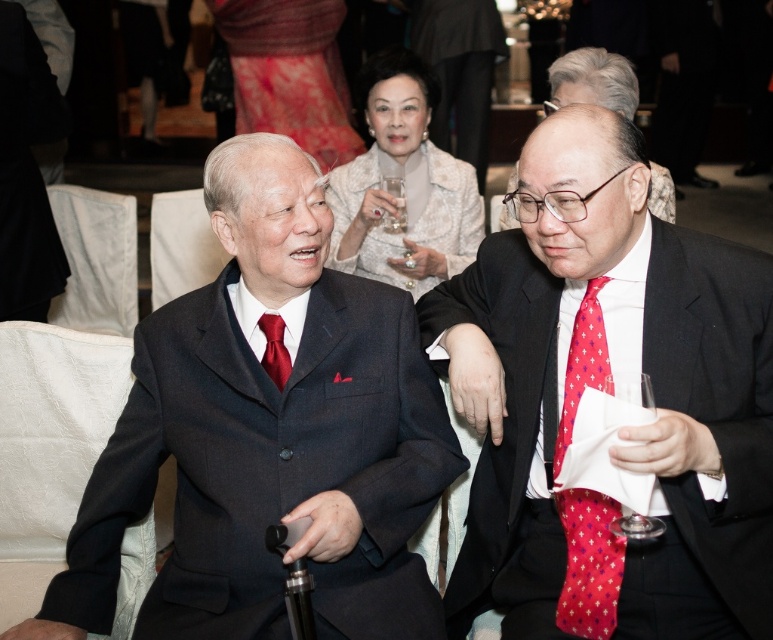
You are a photographer at the event and want to take a photo of both the red silk tie at right and the matte silk tie at center without any obstruction. Based on their positions, can you frame both in the same shot without one blocking the other?

The red silk tie at right is in front of matte silk tie at center, so it would block the view of the matte silk tie at center. To capture both without obstruction, you need to adjust the angle or move the subjects so that they are side by side rather than layered.

You are a photographer at the event and want to capture a photo of the silky red dress at upper center without the clear glass wine glass at right appearing in the foreground. Is this possible given their positions?

The silky red dress at upper center is positioned over the clear glass wine glass at right, so the dress is in front of the glass. Therefore, the photographer can take a photo of the silky red dress at upper center without the clear glass wine glass at right appearing in the foreground because the dress is already obscuring the glass.